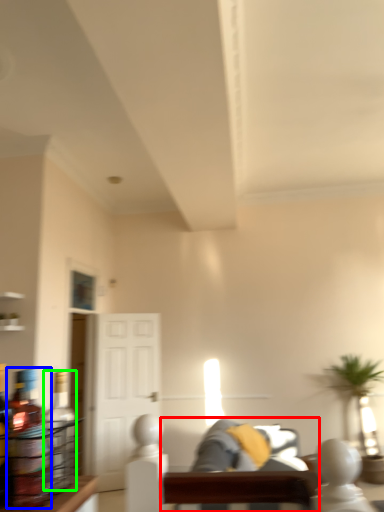
Question: Which object is positioned farthest from couch (highlighted by a red box)? Select from bottle (highlighted by a blue box) and bottle (highlighted by a green box).

Choices:
 (A) bottle
 (B) bottle

Answer: (A)